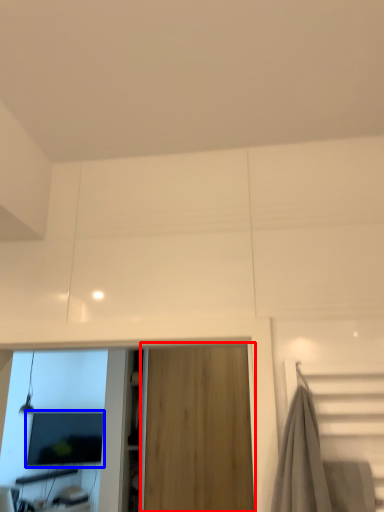
Question: Which of the following is the closest to the observer, garage door (highlighted by a red box) or computer monitor (highlighted by a blue box)?

Choices:
 (A) garage door
 (B) computer monitor

Answer: (A)